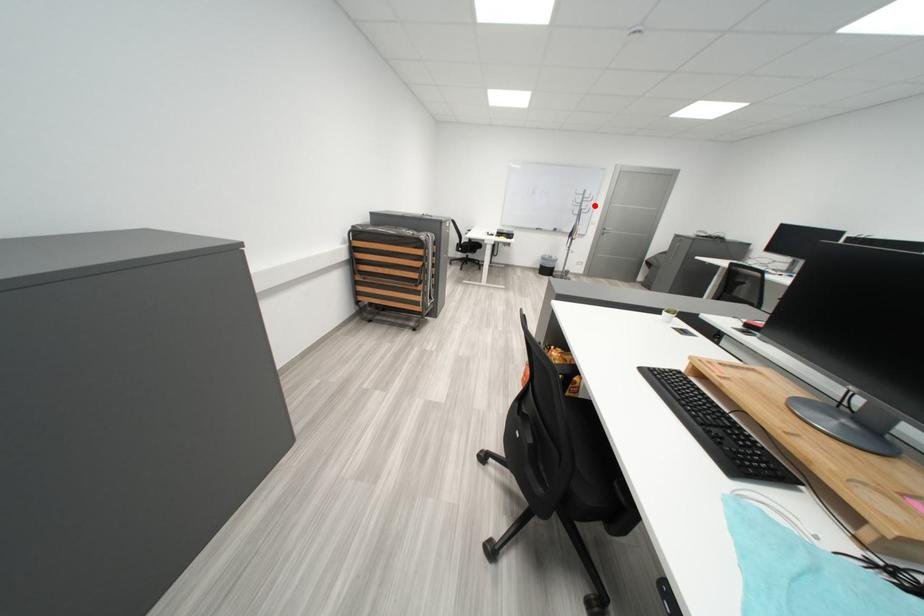
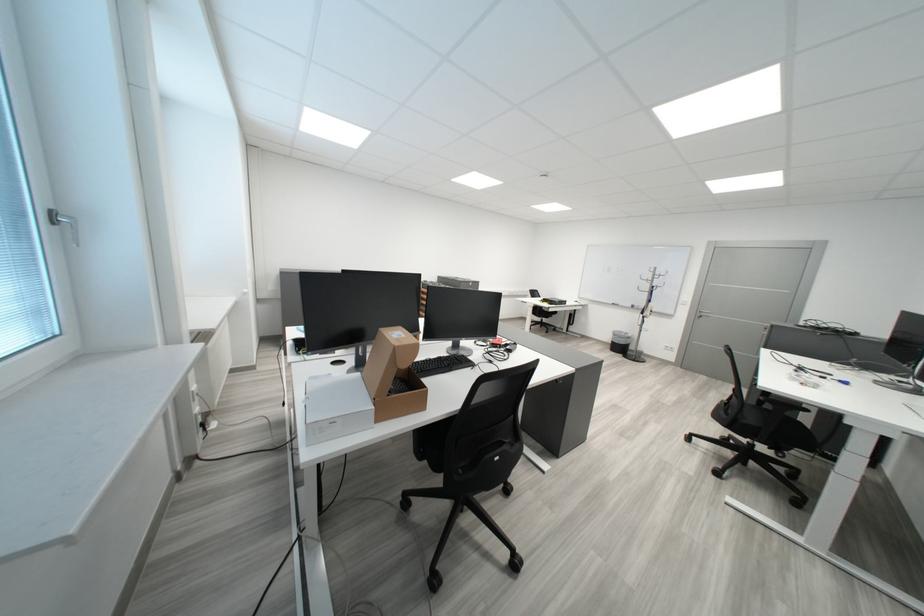
Question: I am providing you with two images of the same scene from different viewpoints. Given a red point in image1, look at the same physical point in image2. Is it:

Choices:
 (A) Closer to the viewpoint
 (B) Farther from the viewpoint

Answer: (B)